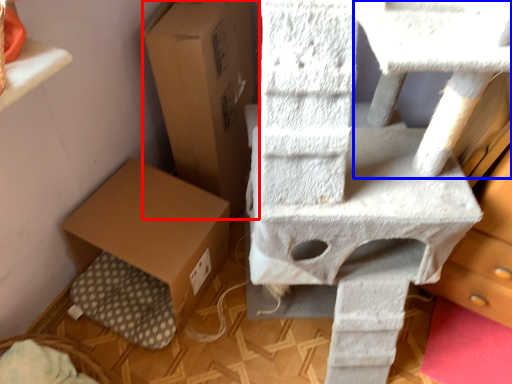
Question: Which object appears closest to the camera in this image, cardboard box (highlighted by a red box) or table (highlighted by a blue box)?

Choices:
 (A) cardboard box
 (B) table

Answer: (B)